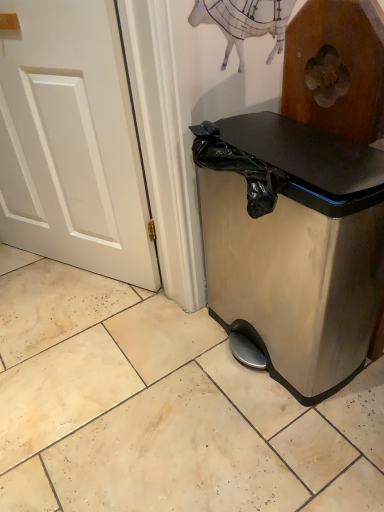
You are a GUI agent. You are given a task and a screenshot of the screen. Output one action in this format:
    pyautogui.click(x=<x>, y=<y>)
    Task: Click on the vacant region under satin silver trash can at lower right (from a real-world perspective)
    Image resolution: width=384 pixels, height=512 pixels.
    Given the screenshot: What is the action you would take?
    pyautogui.click(x=263, y=346)